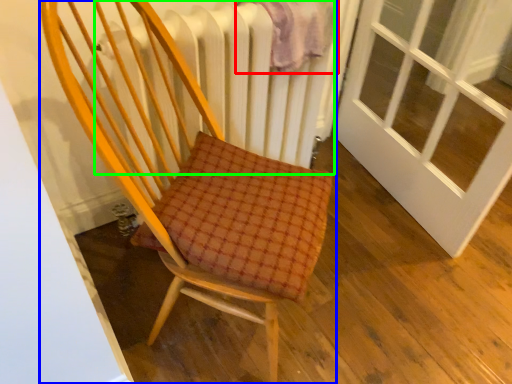
Question: Which is farther away from blanket (highlighted by a red box)? chair (highlighted by a blue box) or radiator (highlighted by a green box)?

Choices:
 (A) chair
 (B) radiator

Answer: (A)